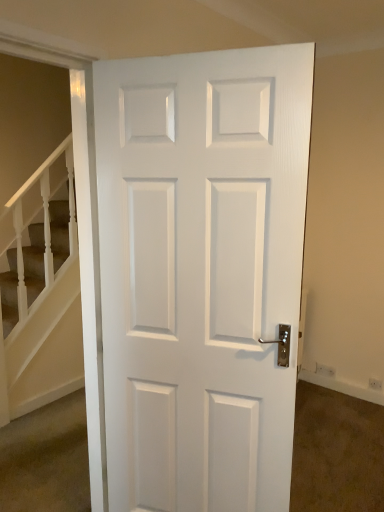
This screenshot has height=512, width=384. I want to click on white glossy door at center, so coord(202,274).

The image size is (384, 512). Describe the element at coordinates (202, 274) in the screenshot. I see `white glossy door at center` at that location.

The width and height of the screenshot is (384, 512). What do you see at coordinates (44, 302) in the screenshot?
I see `white textured stairs at left` at bounding box center [44, 302].

Where is `white textured stairs at left`? The width and height of the screenshot is (384, 512). white textured stairs at left is located at coordinates (44, 302).

What are the coordinates of `white glossy door at center` in the screenshot? It's located at (202, 274).

Considering the relative positions of white glossy door at center and white textured stairs at left in the image provided, is white glossy door at center to the right of white textured stairs at left from the viewer's perspective?

Yes.

Which object is closer to the camera, white glossy door at center or white textured stairs at left?

white glossy door at center is more forward.

Considering the positions of points (211, 471) and (43, 277), is point (211, 471) closer to camera compared to point (43, 277)?

Yes, point (211, 471) is in front of point (43, 277).

From the picture: From the image's perspective, which one is positioned lower, white glossy door at center or white textured stairs at left?

white textured stairs at left.

Looking at this image, from a real-world perspective, is white glossy door at center on top of white textured stairs at left?

Yes.

Which of these two, white glossy door at center or white textured stairs at left, is wider?

white glossy door at center is wider.

Which of these two, white glossy door at center or white textured stairs at left, stands taller?

white glossy door at center.

Can you confirm if white glossy door at center is smaller than white textured stairs at left?

Incorrect, white glossy door at center is not smaller in size than white textured stairs at left.

Is white glossy door at center situated inside white textured stairs at left or outside?

white glossy door at center is not enclosed by white textured stairs at left.

Is white glossy door at center in contact with white textured stairs at left?

No, white glossy door at center is not making contact with white textured stairs at left.

Looking at this image, is white glossy door at center positioned with its back to white textured stairs at left?

white glossy door at center does not have its back to white textured stairs at left.

Locate an element on the screen. This screenshot has height=512, width=384. stairwell that appears on the left of white glossy door at center is located at coordinates (44, 302).

Between white textured stairs at left and white glossy door at center, which one appears on the left side from the viewer's perspective?

white textured stairs at left is more to the left.

Which object is further away from the camera taking this photo, white textured stairs at left or white glossy door at center?

white textured stairs at left is behind.

Which is behind, point (7, 291) or point (280, 216)?

The point (7, 291) is farther from the camera.

From the image's perspective, which one is positioned higher, white textured stairs at left or white glossy door at center?

white glossy door at center, from the image's perspective.

From a real-world perspective, which is physically above, white textured stairs at left or white glossy door at center?

In real-world perspective, white glossy door at center is above.

Which object is wider, white textured stairs at left or white glossy door at center?

With larger width is white glossy door at center.

Considering the sizes of white textured stairs at left and white glossy door at center in the image, is white textured stairs at left taller or shorter than white glossy door at center?

In the image, white textured stairs at left appears to be shorter than white glossy door at center.

Between white textured stairs at left and white glossy door at center, which one has smaller size?

Smaller between the two is white textured stairs at left.

Is white textured stairs at left situated inside white glossy door at center or outside?

white textured stairs at left cannot be found inside white glossy door at center.

Is there a large distance between white textured stairs at left and white glossy door at center?

Yes.

Could you tell me if white textured stairs at left is facing white glossy door at center?

Yes.

How many degrees apart are the facing directions of white textured stairs at left and white glossy door at center?

There is a 70.4-degree angle between the facing directions of white textured stairs at left and white glossy door at center.

In the image, there is a white glossy door at center. Where is `stairwell below it (from the image's perspective)`? The height and width of the screenshot is (512, 384). stairwell below it (from the image's perspective) is located at coordinates click(x=44, y=302).

What are the coordinates of `door that is in front of the white textured stairs at left` in the screenshot? It's located at (202, 274).

In the image, there is a white glossy door at center. Find the location of `stairwell below it (from the image's perspective)`. stairwell below it (from the image's perspective) is located at coordinates (44, 302).